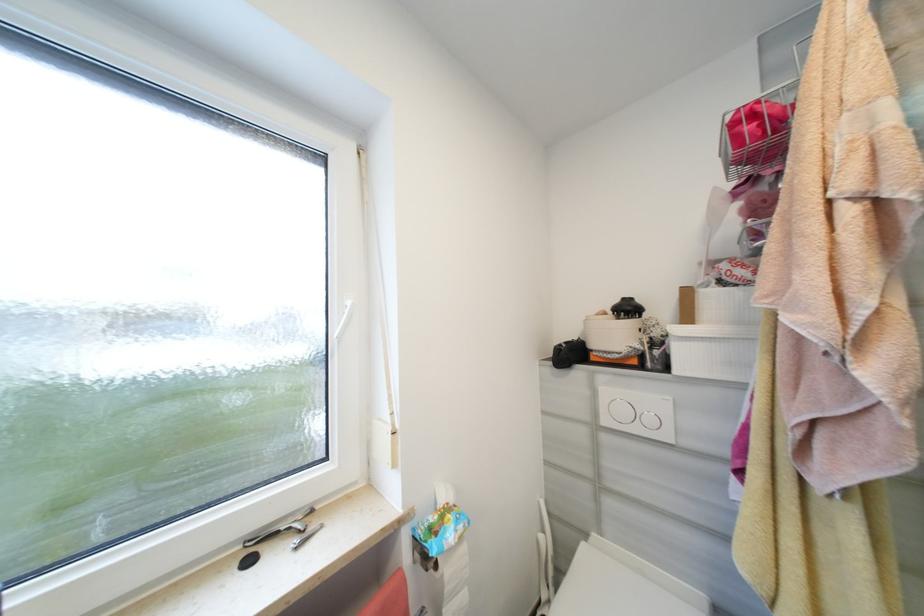
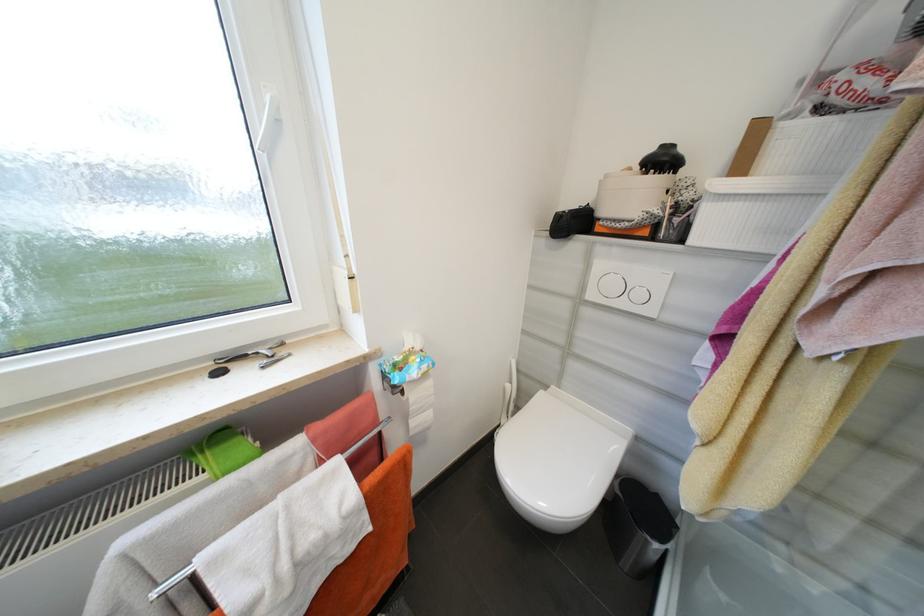
Question: The first image is from the beginning of the video and the second image is from the end. How did the camera likely rotate when shooting the video?

Choices:
 (A) Left
 (B) Right
 (C) Up
 (D) Down

Answer: (D)